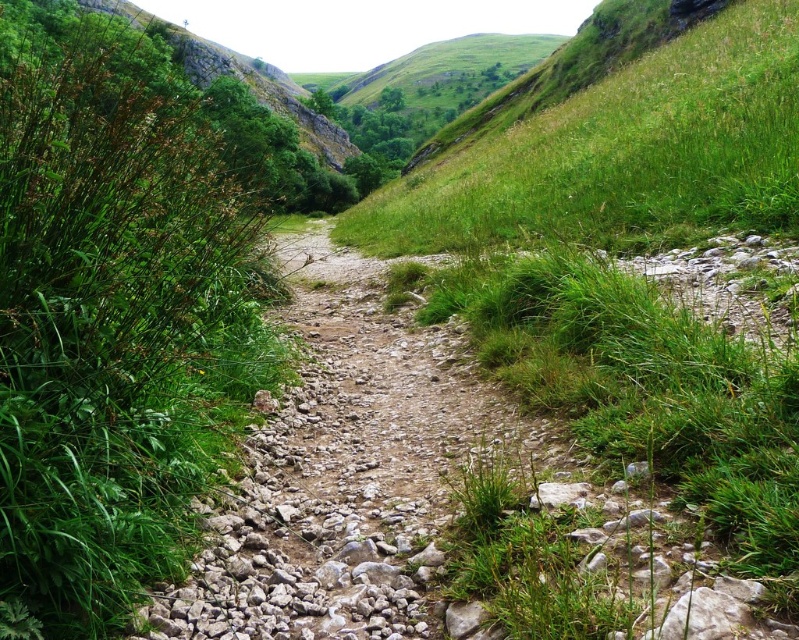
Question: Does green grass at left come behind green grassy hillside at upper center?

Choices:
 (A) no
 (B) yes

Answer: (A)

Question: Which of the following is the farthest from the observer?

Choices:
 (A) green grassy hillside at upper center
 (B) green grass at left

Answer: (A)

Question: Which point is closer to the camera?

Choices:
 (A) (64, 497)
 (B) (615, 99)

Answer: (A)

Question: Does green grass at left appear under green grassy hillside at upper center?

Choices:
 (A) yes
 (B) no

Answer: (B)

Question: Does green grass at left come behind green grassy hillside at upper center?

Choices:
 (A) yes
 (B) no

Answer: (B)